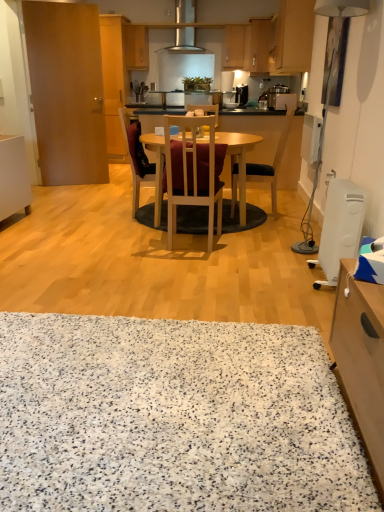
Question: Considering the positions of point (261, 209) and point (129, 24), is point (261, 209) closer or farther from the camera than point (129, 24)?

Choices:
 (A) farther
 (B) closer

Answer: (B)

Question: Is black felt mat at center wider or thinner than matte wood cabinet at upper center, positioned as the fourth cabinetry in right-to-left order?

Choices:
 (A) thin
 (B) wide

Answer: (B)

Question: Considering the real-world distances, which object is farthest from the matte wood cabinet at upper center, positioned as the fourth cabinetry in right-to-left order?

Choices:
 (A) wooden table at center
 (B) wooden chair at center, arranged as the 2th chair when viewed from the left
 (C) wooden cabinet at upper right, the fifth cabinetry in the back-to-front sequence
 (D) white glossy plate at center
 (E) matte gold pot/pan at upper center

Answer: (B)

Question: Considering the real-world distances, which object is closest to the matte wood cabinet at upper center, positioned as the fourth cabinetry in right-to-left order?

Choices:
 (A) white plastic lamp at right
 (B) black fabric chair at center, acting as the 1th chair starting from the right
 (C) satin silver coffee maker at upper center, the first appliance positioned from the top
 (D) brown wooden door at left
 (E) black plastic coffee machine at upper center

Answer: (D)